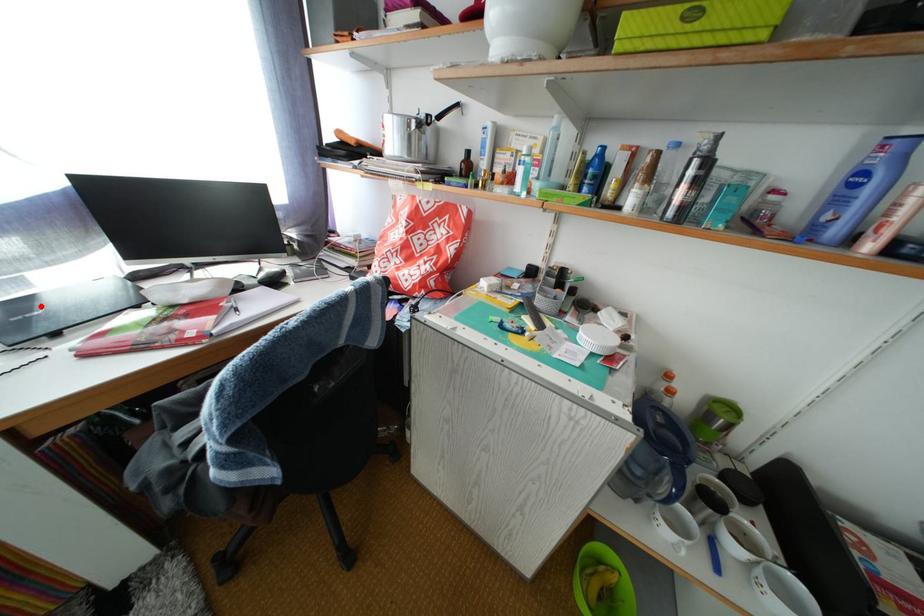
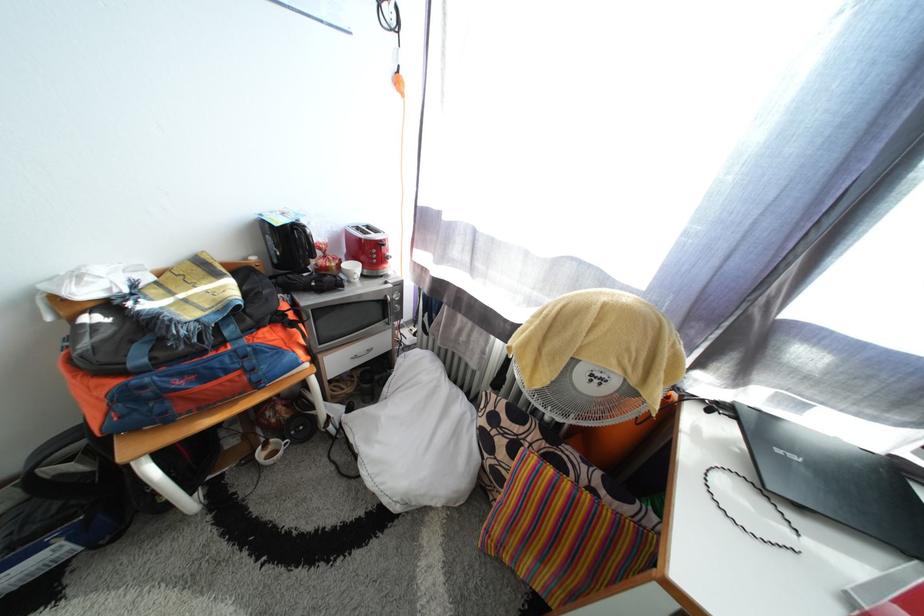
The point at the highlighted location is marked in the first image. Where is the corresponding point in the second image?

(785, 424)